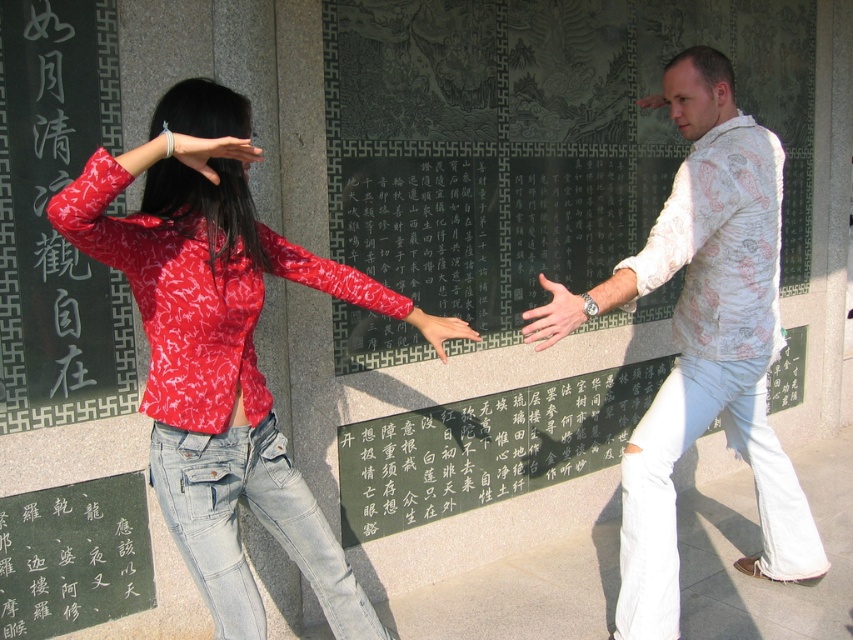
Between matte red blouse at center and denim at right, which one is positioned higher?

Positioned higher is matte red blouse at center.

In order to click on matte red blouse at center in this screenshot , I will do `click(218, 356)`.

Identify the location of matte red blouse at center. (218, 356).

What do you see at coordinates (708, 344) in the screenshot? Image resolution: width=853 pixels, height=640 pixels. I see `white textured shirt at center` at bounding box center [708, 344].

Does point (727, 305) lie behind point (553, 298)?

Yes, it is.

Where is `white textured shirt at center`? The image size is (853, 640). white textured shirt at center is located at coordinates (708, 344).

In the scene shown: How far apart are denim jeans at center and matte white hand at center?

denim jeans at center and matte white hand at center are 32.37 inches apart from each other.

Does denim jeans at center appear on the right side of matte white hand at center?

Incorrect, denim jeans at center is not on the right side of matte white hand at center.

Describe the element at coordinates (258, 520) in the screenshot. The height and width of the screenshot is (640, 853). I see `denim jeans at center` at that location.

You are a GUI agent. You are given a task and a screenshot of the screen. Output one action in this format:
    pyautogui.click(x=<x>, y=<y>)
    Task: Click on the denim jeans at center
    This screenshot has width=853, height=640.
    Given the screenshot: What is the action you would take?
    pyautogui.click(x=258, y=520)